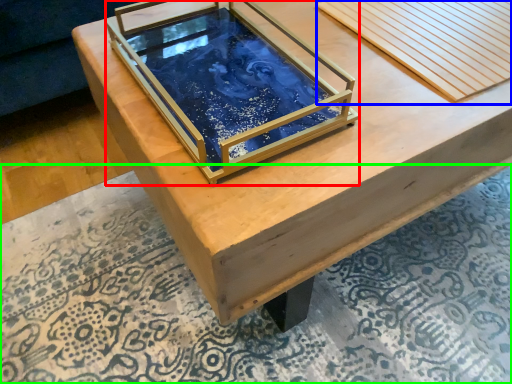
Question: Which object is positioned closest to glass box (highlighted by a red box)? Select from plank (highlighted by a blue box) and mat (highlighted by a green box).

Choices:
 (A) plank
 (B) mat

Answer: (A)